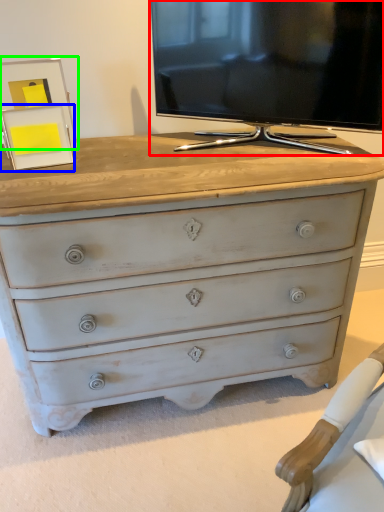
Question: Based on their relative distances, which object is farther from television (highlighted by a red box)? Choose from picture frame (highlighted by a blue box) and picture frame (highlighted by a green box).

Choices:
 (A) picture frame
 (B) picture frame

Answer: (A)